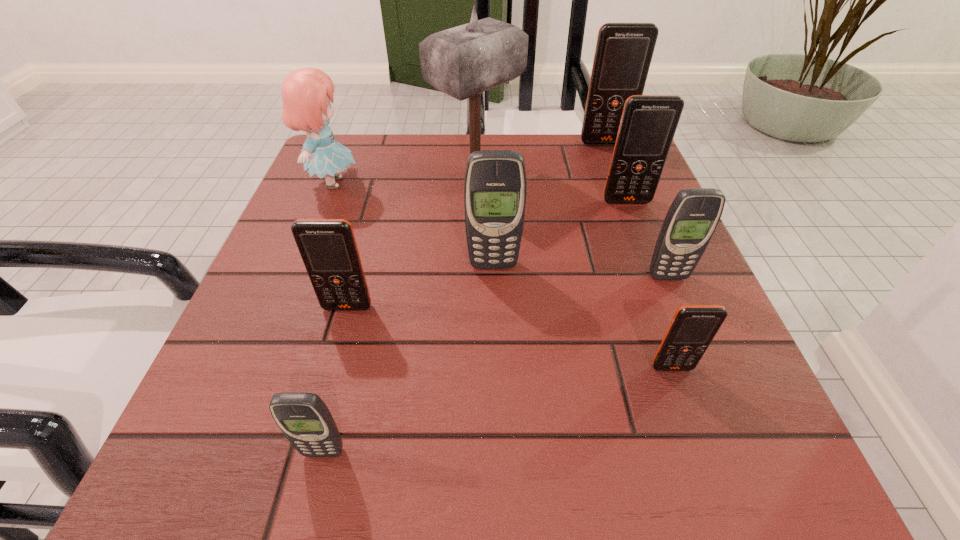
At what (x,y) coordinates should I click in order to perform the action: click on empty space between the third nearest object and the smallest gray cellular telephone. Please return your answer as a coordinate pair (x, y). Looking at the image, I should click on (336, 380).

I want to click on free space between the third nearest orange cellular telephone and the fifth nearest cellular telephone, so click(560, 233).

The image size is (960, 540). In order to click on vacant area between the tallest object and the seventh farthest object in this screenshot , I will do [x=412, y=241].

Identify the location of free space between the sixth farthest cellular telephone and the second nearest gray cellular telephone. This screenshot has width=960, height=540. (670, 322).

Find the location of a particular element. Image resolution: width=960 pixels, height=540 pixels. empty space between the seventh farthest object and the second nearest cellular telephone is located at coordinates (510, 337).

The image size is (960, 540). Identify the location of vacant space that's between the sixth farthest cellular telephone and the tallest cellular telephone. (638, 255).

This screenshot has width=960, height=540. In order to click on vacant space that is in between the tallest object and the doll in this screenshot , I will do `click(404, 179)`.

Where is `empty space that is in between the doll and the nearest cellular telephone`? This screenshot has height=540, width=960. empty space that is in between the doll and the nearest cellular telephone is located at coordinates pos(328,318).

Identify the location of object that is the sixth closest to the third farthest orange cellular telephone. The image size is (960, 540). (694, 214).

Image resolution: width=960 pixels, height=540 pixels. I want to click on object that stands as the fifth closest to the tallest object, so click(x=328, y=248).